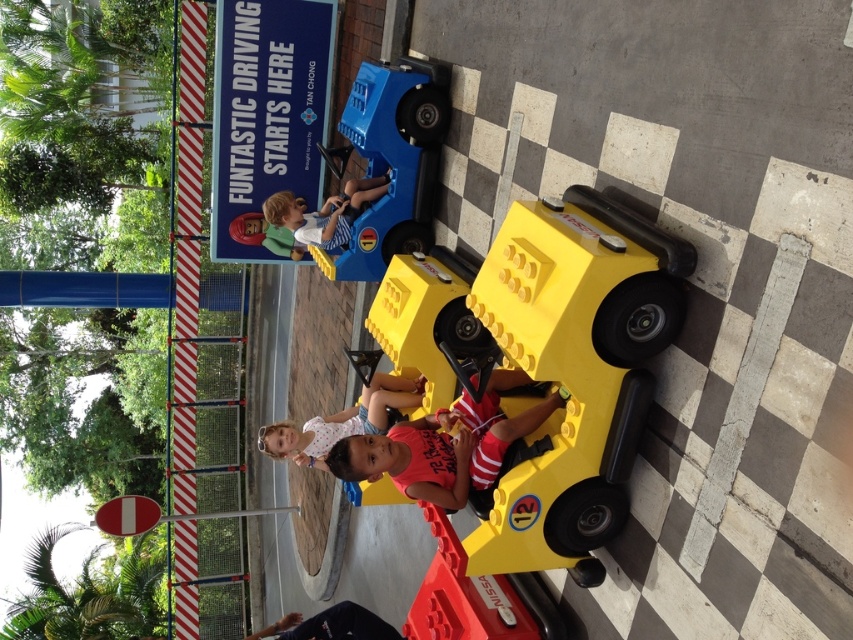
Describe the element at coordinates (323, 212) in the screenshot. The width and height of the screenshot is (853, 640). I see `matte blue shirt at center` at that location.

Is matte blue shirt at center further to the viewer compared to dark blue jeans at lower center?

Yes, it is.

Does point (277, 204) come behind point (341, 609)?

Yes, point (277, 204) is behind point (341, 609).

The width and height of the screenshot is (853, 640). I want to click on matte blue shirt at center, so click(x=323, y=212).

Which is more to the left, yellow plastic toy car at center or matte blue shirt at center?

From the viewer's perspective, matte blue shirt at center appears more on the left side.

Is point (534, 237) more distant than point (289, 221)?

No.

Is point (604, 269) positioned behind point (367, 202)?

That is False.

Where is `yellow plastic toy car at center`? The image size is (853, 640). yellow plastic toy car at center is located at coordinates (547, 362).

Is yellow plastic toy car at center bigger than matte pink shirt at center?

Correct, yellow plastic toy car at center is larger in size than matte pink shirt at center.

Is yellow plastic toy car at center above matte pink shirt at center?

Correct, yellow plastic toy car at center is located above matte pink shirt at center.

Describe the element at coordinates (547, 362) in the screenshot. The height and width of the screenshot is (640, 853). I see `yellow plastic toy car at center` at that location.

I want to click on yellow plastic toy car at center, so click(x=547, y=362).